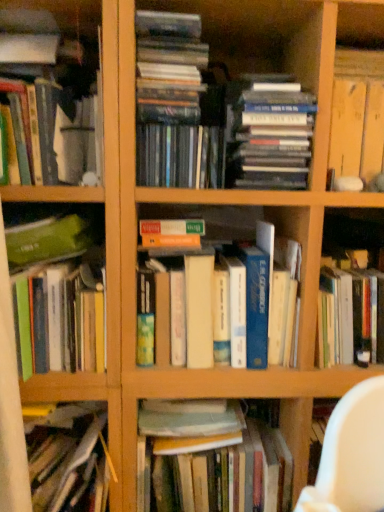
Question: Can you confirm if matte white vase at upper left, the fourth book from the top, is smaller than hardcover books at center, the 7th book in the top-to-bottom sequence?

Choices:
 (A) no
 (B) yes

Answer: (B)

Question: Is matte white vase at upper left, the 7th book when ordered from bottom to top, turned away from hardcover books at center, which is the fourth book in bottom-to-top order?

Choices:
 (A) no
 (B) yes

Answer: (A)

Question: From the image's perspective, is matte white vase at upper left, the fourth book from the top, on hardcover books at center, which is the fourth book in bottom-to-top order?

Choices:
 (A) yes
 (B) no

Answer: (A)

Question: Does matte white vase at upper left, the fourth book from the top, have a lesser width compared to hardcover books at center, the 7th book in the top-to-bottom sequence?

Choices:
 (A) no
 (B) yes

Answer: (A)

Question: Is matte white vase at upper left, the fourth book from the top, at the right side of hardcover books at center, the 7th book in the top-to-bottom sequence?

Choices:
 (A) yes
 (B) no

Answer: (B)

Question: From the image's perspective, relative to hardcover books at center, the first book when ordered from top to bottom, is hardcover book at upper right, the third book from the top, above or below?

Choices:
 (A) above
 (B) below

Answer: (B)

Question: In the image, is hardcover book at upper right, the eighth book positioned from the bottom, on the left side or the right side of hardcover books at center, arranged as the tenth book when ordered from the bottom?

Choices:
 (A) right
 (B) left

Answer: (A)

Question: Considering their positions, is hardcover book at upper right, the third book from the top, located in front of or behind hardcover books at center, arranged as the tenth book when ordered from the bottom?

Choices:
 (A) behind
 (B) front

Answer: (A)

Question: In terms of width, does hardcover book at upper right, the eighth book positioned from the bottom, look wider or thinner when compared to hardcover books at center, the first book when ordered from top to bottom?

Choices:
 (A) thin
 (B) wide

Answer: (A)

Question: Is point (299, 150) positioned closer to the camera than point (183, 109)?

Choices:
 (A) farther
 (B) closer

Answer: (A)

Question: Is hardcover book at upper center, which is the ninth book from bottom to top, taller or shorter than hardcover books at center, the first book when ordered from top to bottom?

Choices:
 (A) tall
 (B) short

Answer: (A)

Question: From the image's perspective, relative to hardcover books at center, the first book when ordered from top to bottom, is hardcover book at upper center, the 2th book viewed from the top, above or below?

Choices:
 (A) above
 (B) below

Answer: (B)

Question: Considering their positions, is hardcover book at upper center, the 2th book viewed from the top, located in front of or behind hardcover books at center, the first book when ordered from top to bottom?

Choices:
 (A) front
 (B) behind

Answer: (A)

Question: Based on their positions, is hardcover book at upper right, the eighth book positioned from the bottom, located to the left or right of matte white vase at upper left, the fourth book from the top?

Choices:
 (A) right
 (B) left

Answer: (A)

Question: Is hardcover book at upper right, the eighth book positioned from the bottom, spatially inside matte white vase at upper left, the fourth book from the top, or outside of it?

Choices:
 (A) inside
 (B) outside

Answer: (B)